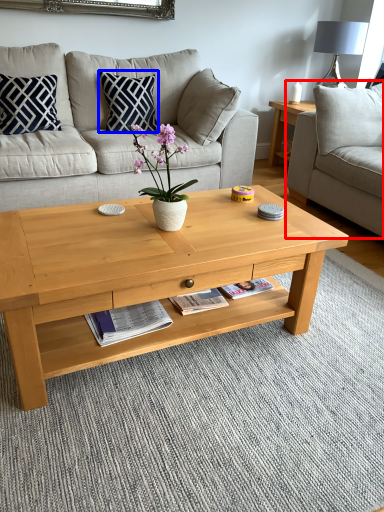
Question: Which point is further to the camera, studio couch (highlighted by a red box) or pillow (highlighted by a blue box)?

Choices:
 (A) studio couch
 (B) pillow

Answer: (B)